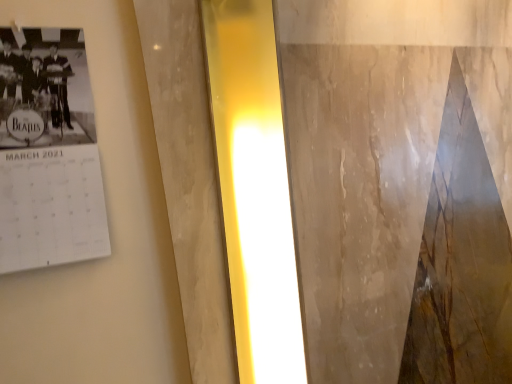
Question: Should I look upward or downward to see white paper calendar at upper left?

Choices:
 (A) up
 (B) down

Answer: (A)